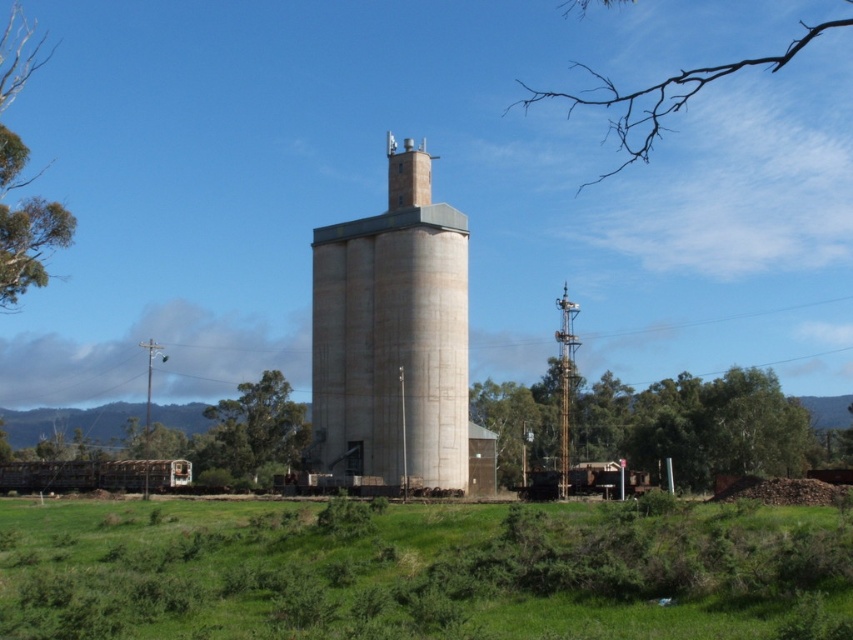
Question: In this image, where is brown branch at upper right located relative to green leafy tree at center?

Choices:
 (A) below
 (B) above

Answer: (B)

Question: Among these objects, which one is farthest from the camera?

Choices:
 (A) green leafy tree at center
 (B) smooth concrete chimney at upper center

Answer: (A)

Question: Which of the following is the closest to the observer?

Choices:
 (A) brown branch at upper right
 (B) green leafy tree at upper left
 (C) smooth concrete chimney at upper center

Answer: (B)

Question: Can you confirm if concrete tower at center is thinner than brown branch at upper right?

Choices:
 (A) yes
 (B) no

Answer: (A)

Question: Which is farther from the green leafy tree at upper left?

Choices:
 (A) green leafy tree at center
 (B) green leafy tree at right
 (C) green grass at center
 (D) concrete tower at center

Answer: (B)

Question: Does brown branch at upper right come behind green leafy tree at center?

Choices:
 (A) no
 (B) yes

Answer: (B)